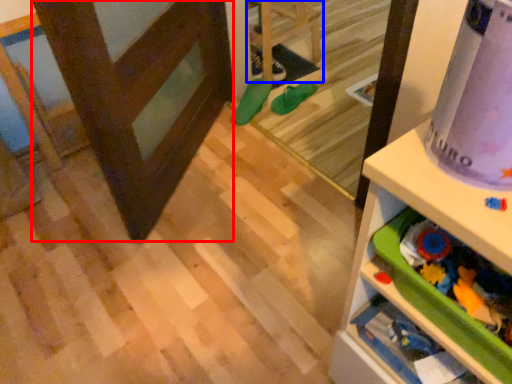
Question: Which point is closer to the camera, screen door (highlighted by a red box) or furniture (highlighted by a blue box)?

Choices:
 (A) screen door
 (B) furniture

Answer: (A)